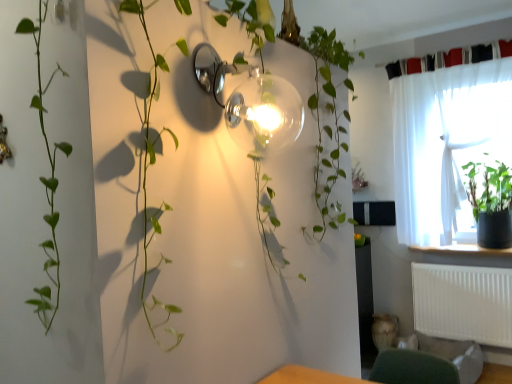
Question: Is white sheer curtain at upper right, which ranks as the 2th curtain in top-to-bottom order, to the right of white plastic radiator at lower right from the viewer's perspective?

Choices:
 (A) yes
 (B) no

Answer: (B)

Question: Is white sheer curtain at upper right, which ranks as the 2th curtain in top-to-bottom order, oriented away from white plastic radiator at lower right?

Choices:
 (A) no
 (B) yes

Answer: (A)

Question: Is white sheer curtain at upper right, which ranks as the 2th curtain in top-to-bottom order, positioned far away from white plastic radiator at lower right?

Choices:
 (A) yes
 (B) no

Answer: (B)

Question: Can you confirm if white sheer curtain at upper right, which is the 1th curtain from bottom to top, is shorter than white plastic radiator at lower right?

Choices:
 (A) no
 (B) yes

Answer: (A)

Question: From the image's perspective, would you say white sheer curtain at upper right, which is the 1th curtain from bottom to top, is shown under white plastic radiator at lower right?

Choices:
 (A) yes
 (B) no

Answer: (B)

Question: Is white sheer curtain at upper right, which ranks as the 2th curtain in top-to-bottom order, wider than white plastic radiator at lower right?

Choices:
 (A) no
 (B) yes

Answer: (B)

Question: Is green fabric swivel chair at lower right positioned in front of white plastic radiator at lower right?

Choices:
 (A) yes
 (B) no

Answer: (A)

Question: Considering the relative sizes of green fabric swivel chair at lower right and white plastic radiator at lower right in the image provided, is green fabric swivel chair at lower right taller than white plastic radiator at lower right?

Choices:
 (A) no
 (B) yes

Answer: (A)

Question: Considering the relative sizes of green fabric swivel chair at lower right and white plastic radiator at lower right in the image provided, is green fabric swivel chair at lower right thinner than white plastic radiator at lower right?

Choices:
 (A) yes
 (B) no

Answer: (B)

Question: Does green fabric swivel chair at lower right have a smaller size compared to white plastic radiator at lower right?

Choices:
 (A) no
 (B) yes

Answer: (A)

Question: Can you confirm if green fabric swivel chair at lower right is shorter than white plastic radiator at lower right?

Choices:
 (A) no
 (B) yes

Answer: (B)

Question: From the image's perspective, is green fabric swivel chair at lower right located above white plastic radiator at lower right?

Choices:
 (A) yes
 (B) no

Answer: (B)

Question: From the image's perspective, is black fabric curtain at upper right, which ranks as the second curtain in bottom-to-top order, on white sheer curtain at upper right, which ranks as the 2th curtain in top-to-bottom order?

Choices:
 (A) yes
 (B) no

Answer: (A)